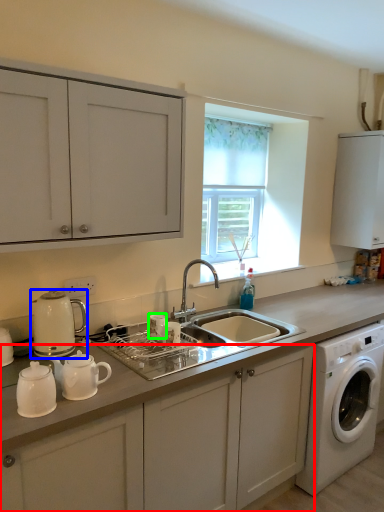
Question: Which object is the closest to the cabinetry (highlighted by a red box)? Choose among these: coffeepot (highlighted by a blue box) or appliance (highlighted by a green box).

Choices:
 (A) coffeepot
 (B) appliance

Answer: (B)